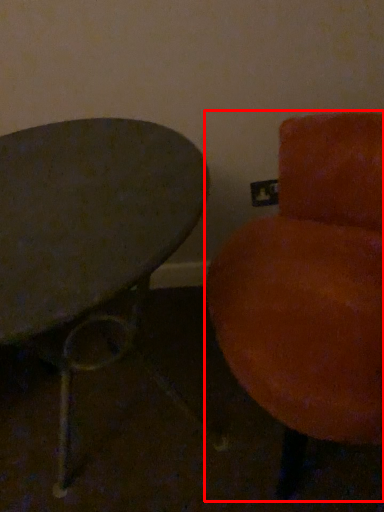
Question: From the image's perspective, where is chair (annotated by the red box) located in relation to table in the image?

Choices:
 (A) above
 (B) below

Answer: (A)